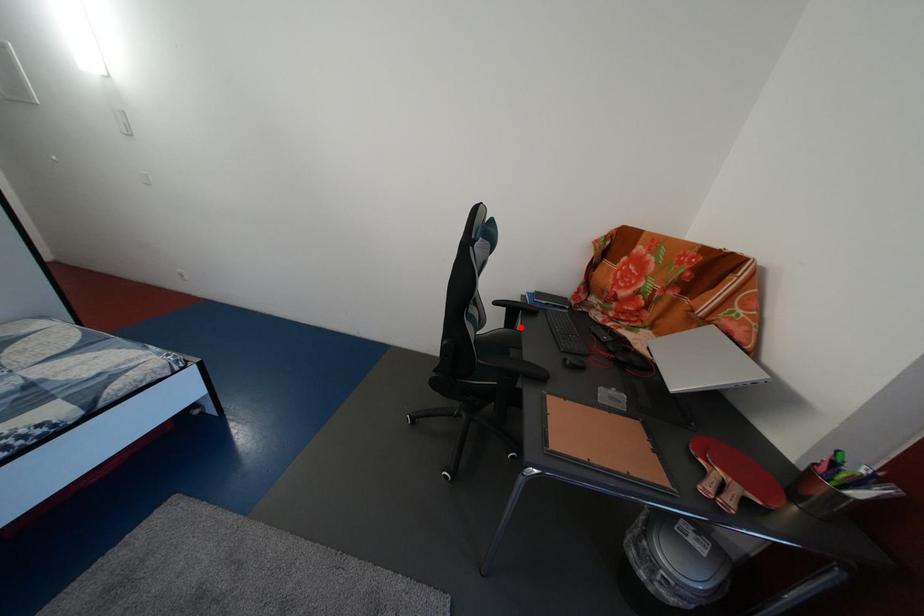
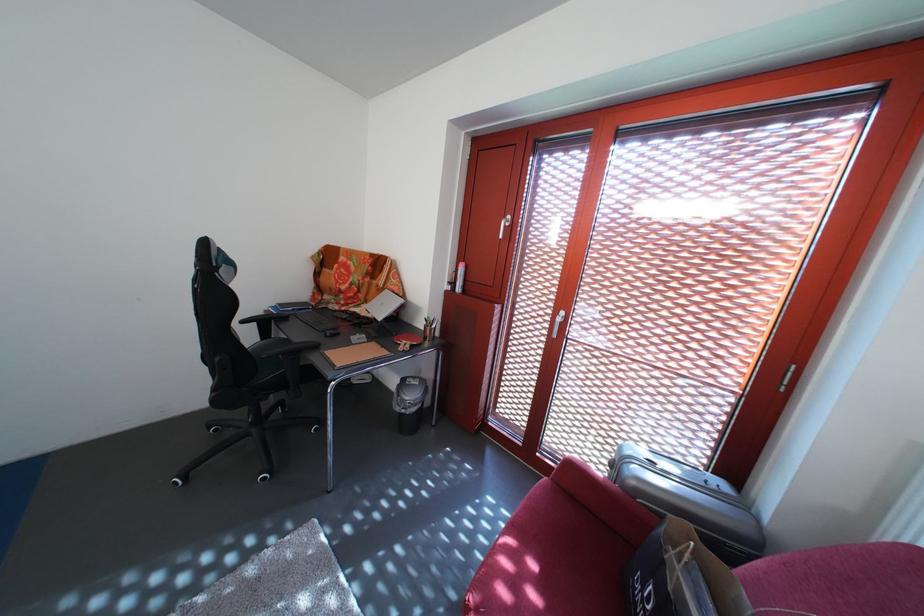
Question: I am providing you with two images of the same scene from different viewpoints. A red point is shown in image1. For the corresponding object point in image2, is it positioned nearer or farther from the camera?

Choices:
 (A) Nearer
 (B) Farther

Answer: (B)